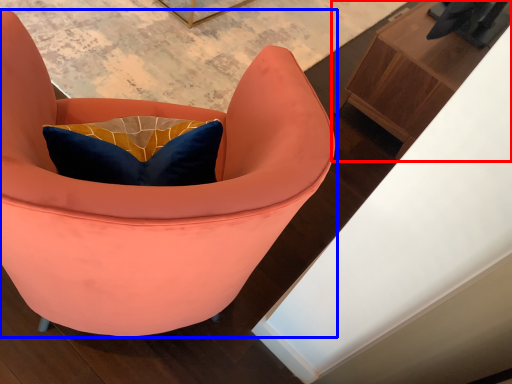
Question: Which object appears closest to the camera in this image, furniture (highlighted by a red box) or chair (highlighted by a blue box)?

Choices:
 (A) furniture
 (B) chair

Answer: (B)